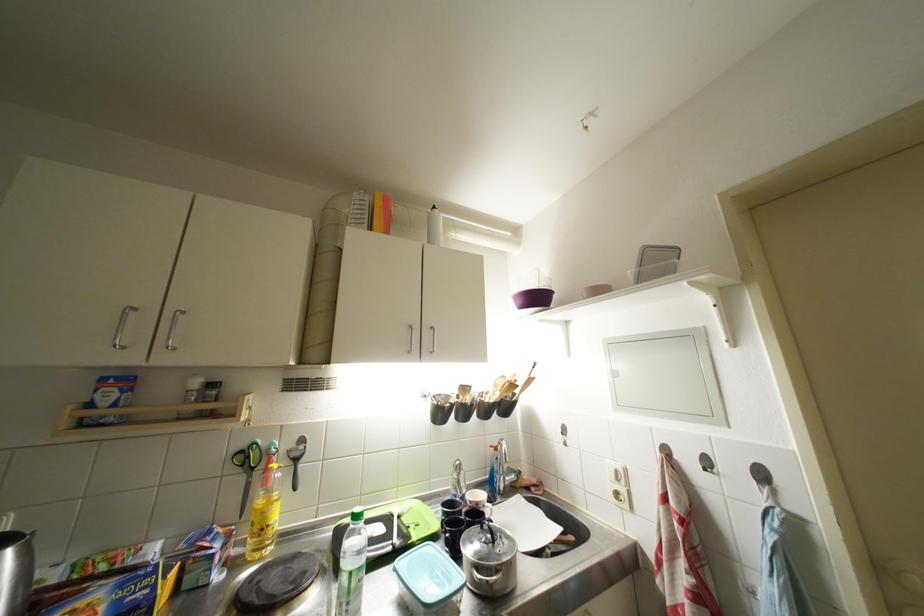
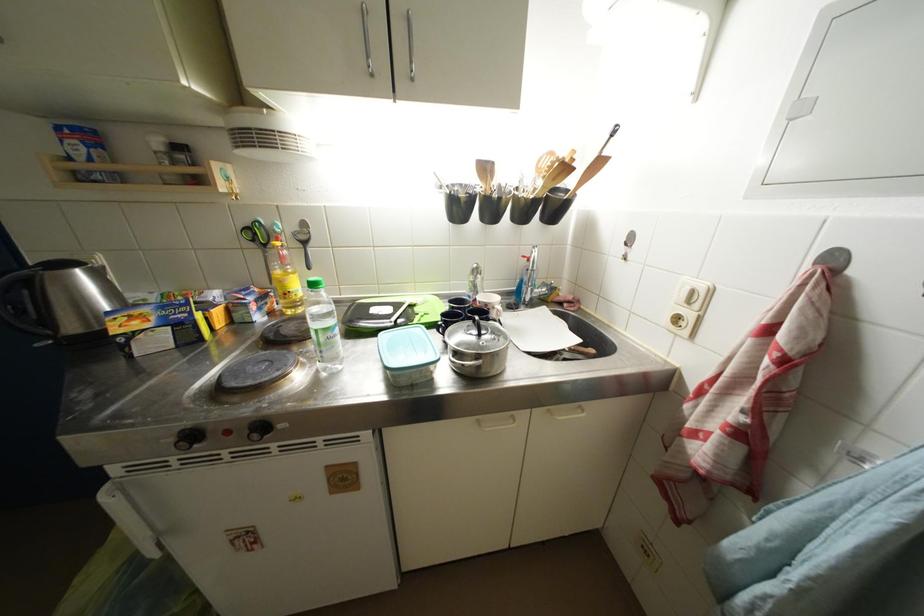
In the second image, find the point that corresponds to (624,484) in the first image.

(696, 306)